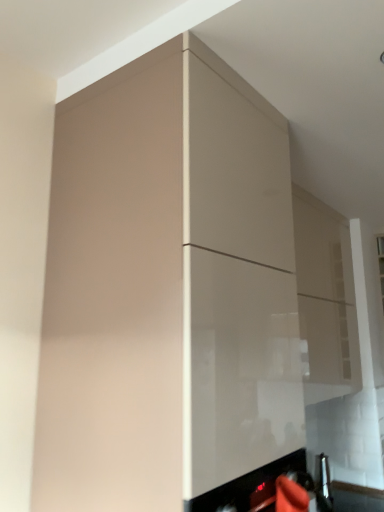
In order to click on glossy beige cabinet at upper center, which is the 2th cabinetry in front-to-back order in this screenshot , I will do `click(325, 300)`.

Describe the element at coordinates (325, 300) in the screenshot. I see `glossy beige cabinet at upper center, the second cabinetry viewed from the left` at that location.

Describe the element at coordinates (162, 283) in the screenshot. The width and height of the screenshot is (384, 512). I see `matte beige cabinet at center, which ranks as the 1th cabinetry in front-to-back order` at that location.

You are a GUI agent. You are given a task and a screenshot of the screen. Output one action in this format:
    pyautogui.click(x=<x>, y=<y>)
    Task: Click on the matte beige cabinet at center, acting as the 2th cabinetry starting from the right
    The height and width of the screenshot is (512, 384).
    Given the screenshot: What is the action you would take?
    pyautogui.click(x=162, y=283)

At what (x,y) coordinates should I click in order to perform the action: click on glossy beige cabinet at upper center, which is the 2th cabinetry in front-to-back order. Please return your answer as a coordinate pair (x, y). The image size is (384, 512). Looking at the image, I should click on (325, 300).

Is glossy beige cabinet at upper center, the second cabinetry viewed from the left, to the left of matte beige cabinet at center, the second cabinetry from the back, from the viewer's perspective?

No.

From the picture: In the image, is glossy beige cabinet at upper center, the second cabinetry viewed from the left, positioned in front of or behind matte beige cabinet at center, which ranks as the 1th cabinetry in front-to-back order?

glossy beige cabinet at upper center, the second cabinetry viewed from the left, is behind matte beige cabinet at center, which ranks as the 1th cabinetry in front-to-back order.

Which is behind, point (308, 196) or point (104, 426)?

Point (308, 196)

Consider the image. From the image's perspective, is glossy beige cabinet at upper center, the first cabinetry in the right-to-left sequence, over matte beige cabinet at center, the first cabinetry from the left?

Actually, glossy beige cabinet at upper center, the first cabinetry in the right-to-left sequence, appears below matte beige cabinet at center, the first cabinetry from the left, in the image.

From a real-world perspective, is glossy beige cabinet at upper center, the second cabinetry viewed from the left, above or below matte beige cabinet at center, acting as the 2th cabinetry starting from the right?

In terms of real-world spatial position, glossy beige cabinet at upper center, the second cabinetry viewed from the left, is above matte beige cabinet at center, acting as the 2th cabinetry starting from the right.

Can you confirm if glossy beige cabinet at upper center, which appears as the first cabinetry when viewed from the back, is wider than matte beige cabinet at center, acting as the 2th cabinetry starting from the right?

No.

Between glossy beige cabinet at upper center, the first cabinetry in the right-to-left sequence, and matte beige cabinet at center, the second cabinetry from the back, which one has more height?

matte beige cabinet at center, the second cabinetry from the back, is taller.

Which of these two, glossy beige cabinet at upper center, the first cabinetry in the right-to-left sequence, or matte beige cabinet at center, acting as the 2th cabinetry starting from the right, is smaller?

glossy beige cabinet at upper center, the first cabinetry in the right-to-left sequence.

Is glossy beige cabinet at upper center, the first cabinetry in the right-to-left sequence, inside or outside of matte beige cabinet at center, which ranks as the 1th cabinetry in front-to-back order?

glossy beige cabinet at upper center, the first cabinetry in the right-to-left sequence, is not enclosed by matte beige cabinet at center, which ranks as the 1th cabinetry in front-to-back order.

Is there a large distance between glossy beige cabinet at upper center, the second cabinetry viewed from the left, and matte beige cabinet at center, acting as the 2th cabinetry starting from the right?

Absolutely, glossy beige cabinet at upper center, the second cabinetry viewed from the left, is distant from matte beige cabinet at center, acting as the 2th cabinetry starting from the right.

Consider the image. Is glossy beige cabinet at upper center, which is the 2th cabinetry in front-to-back order, positioned with its back to matte beige cabinet at center, the second cabinetry from the back?

glossy beige cabinet at upper center, which is the 2th cabinetry in front-to-back order, does not have its back to matte beige cabinet at center, the second cabinetry from the back.

How different are the orientations of glossy beige cabinet at upper center, the second cabinetry viewed from the left, and matte beige cabinet at center, which ranks as the 1th cabinetry in front-to-back order, in degrees?

0.000725 degrees.

Find the location of a particular element. The image size is (384, 512). cabinetry below the glossy beige cabinet at upper center, which appears as the first cabinetry when viewed from the back (from a real-world perspective) is located at coordinates (162, 283).

Is matte beige cabinet at center, the second cabinetry from the back, to the left or to the right of glossy beige cabinet at upper center, the second cabinetry viewed from the left, in the image?

Clearly, matte beige cabinet at center, the second cabinetry from the back, is on the left of glossy beige cabinet at upper center, the second cabinetry viewed from the left, in the image.

Is the position of matte beige cabinet at center, the first cabinetry from the left, less distant than that of glossy beige cabinet at upper center, the second cabinetry viewed from the left?

Yes, matte beige cabinet at center, the first cabinetry from the left, is closer to the viewer.

Which is behind, point (256, 447) or point (304, 295)?

Positioned behind is point (304, 295).

From the image's perspective, which is below, matte beige cabinet at center, the second cabinetry from the back, or glossy beige cabinet at upper center, which is the 2th cabinetry in front-to-back order?

glossy beige cabinet at upper center, which is the 2th cabinetry in front-to-back order, appears lower in the image.

From a real-world perspective, between matte beige cabinet at center, the first cabinetry from the left, and glossy beige cabinet at upper center, which is the 2th cabinetry in front-to-back order, who is vertically higher?

In real-world perspective, glossy beige cabinet at upper center, which is the 2th cabinetry in front-to-back order, is above.

Is matte beige cabinet at center, which ranks as the 1th cabinetry in front-to-back order, wider than glossy beige cabinet at upper center, the first cabinetry in the right-to-left sequence?

Correct, the width of matte beige cabinet at center, which ranks as the 1th cabinetry in front-to-back order, exceeds that of glossy beige cabinet at upper center, the first cabinetry in the right-to-left sequence.

Between matte beige cabinet at center, the first cabinetry from the left, and glossy beige cabinet at upper center, which is the 2th cabinetry in front-to-back order, which one has more height?

Standing taller between the two is matte beige cabinet at center, the first cabinetry from the left.

Considering the sizes of objects matte beige cabinet at center, the first cabinetry from the left, and glossy beige cabinet at upper center, the second cabinetry viewed from the left, in the image provided, who is bigger, matte beige cabinet at center, the first cabinetry from the left, or glossy beige cabinet at upper center, the second cabinetry viewed from the left,?

matte beige cabinet at center, the first cabinetry from the left.

Would you say matte beige cabinet at center, which ranks as the 1th cabinetry in front-to-back order, contains glossy beige cabinet at upper center, which appears as the first cabinetry when viewed from the back?

No, glossy beige cabinet at upper center, which appears as the first cabinetry when viewed from the back, is located outside of matte beige cabinet at center, which ranks as the 1th cabinetry in front-to-back order.

Is matte beige cabinet at center, the first cabinetry from the left, beside glossy beige cabinet at upper center, which appears as the first cabinetry when viewed from the back?

No, matte beige cabinet at center, the first cabinetry from the left, is not with glossy beige cabinet at upper center, which appears as the first cabinetry when viewed from the back.

Could you tell me if matte beige cabinet at center, acting as the 2th cabinetry starting from the right, is facing glossy beige cabinet at upper center, which is the 2th cabinetry in front-to-back order?

No, matte beige cabinet at center, acting as the 2th cabinetry starting from the right, is not aimed at glossy beige cabinet at upper center, which is the 2th cabinetry in front-to-back order.

What's the angular difference between matte beige cabinet at center, which ranks as the 1th cabinetry in front-to-back order, and glossy beige cabinet at upper center, the second cabinetry viewed from the left,'s facing directions?

matte beige cabinet at center, which ranks as the 1th cabinetry in front-to-back order, and glossy beige cabinet at upper center, the second cabinetry viewed from the left, are facing 0.000725 degrees away from each other.

How distant is matte beige cabinet at center, the second cabinetry from the back, from glossy beige cabinet at upper center, which appears as the first cabinetry when viewed from the back?

1.06 meters.

You are a GUI agent. You are given a task and a screenshot of the screen. Output one action in this format:
    pyautogui.click(x=<x>, y=<y>)
    Task: Click on the cabinetry on the left side of glossy beige cabinet at upper center, which is the 2th cabinetry in front-to-back order
    This screenshot has height=512, width=384.
    Given the screenshot: What is the action you would take?
    pyautogui.click(x=162, y=283)

The width and height of the screenshot is (384, 512). I want to click on cabinetry below the matte beige cabinet at center, acting as the 2th cabinetry starting from the right (from the image's perspective), so click(325, 300).

In order to click on cabinetry above the glossy beige cabinet at upper center, the first cabinetry in the right-to-left sequence (from the image's perspective) in this screenshot , I will do `click(162, 283)`.